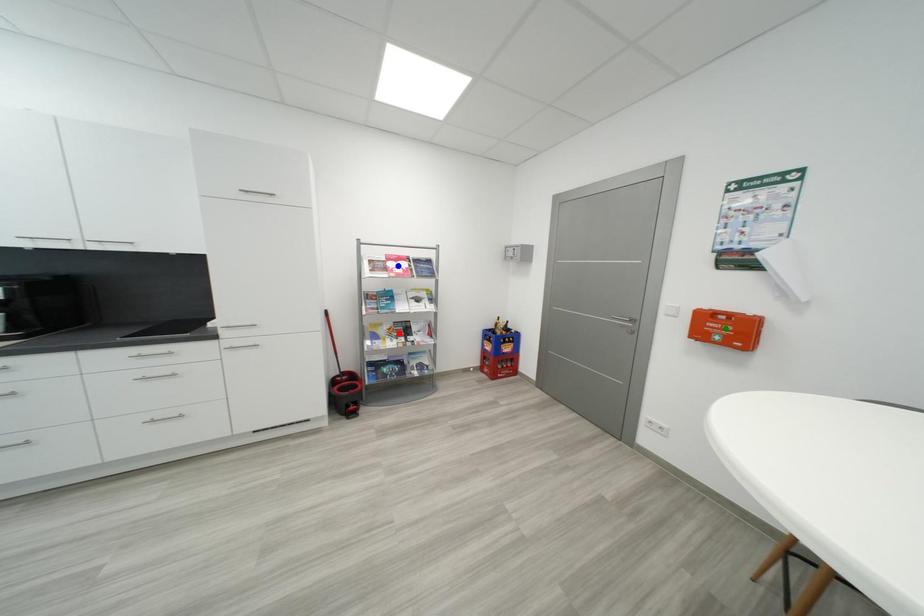
Order these from nearest to farthest:
A) green point
B) blue point
C) red point

green point, blue point, red point